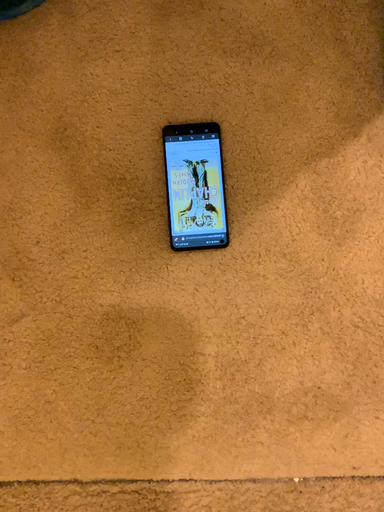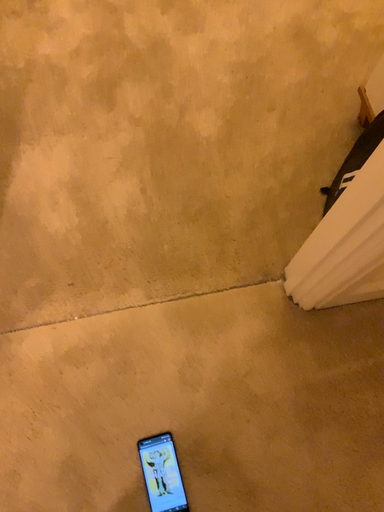
Question: Which way did the camera rotate in the video?

Choices:
 (A) rotated downward
 (B) rotated upward

Answer: (B)